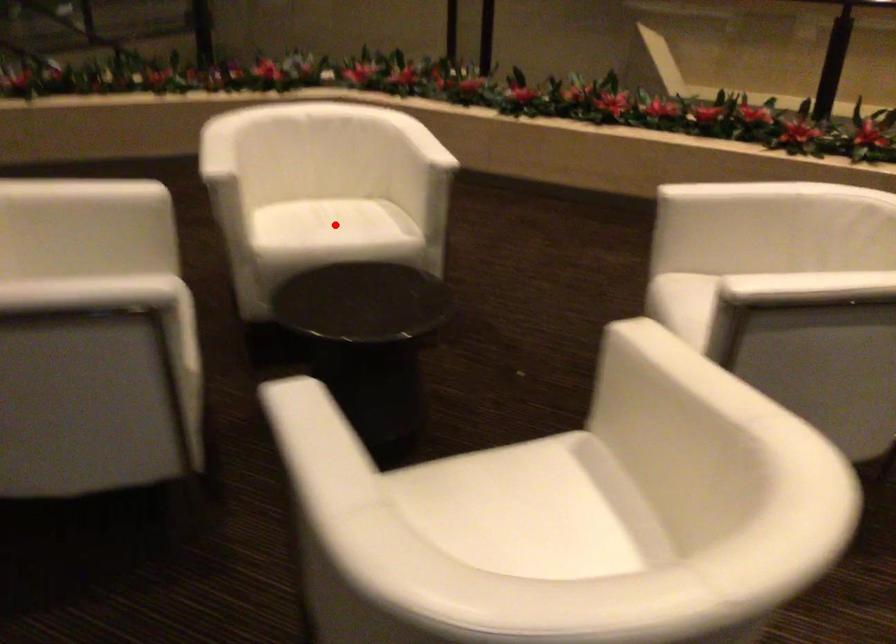
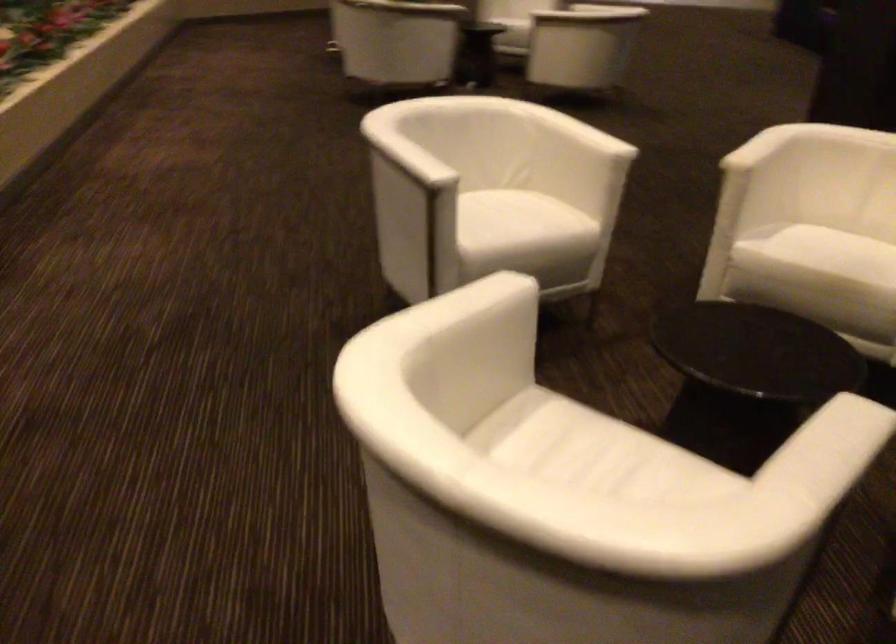
In the second image, find the point that corresponds to the highlighted location in the first image.

(616, 462)